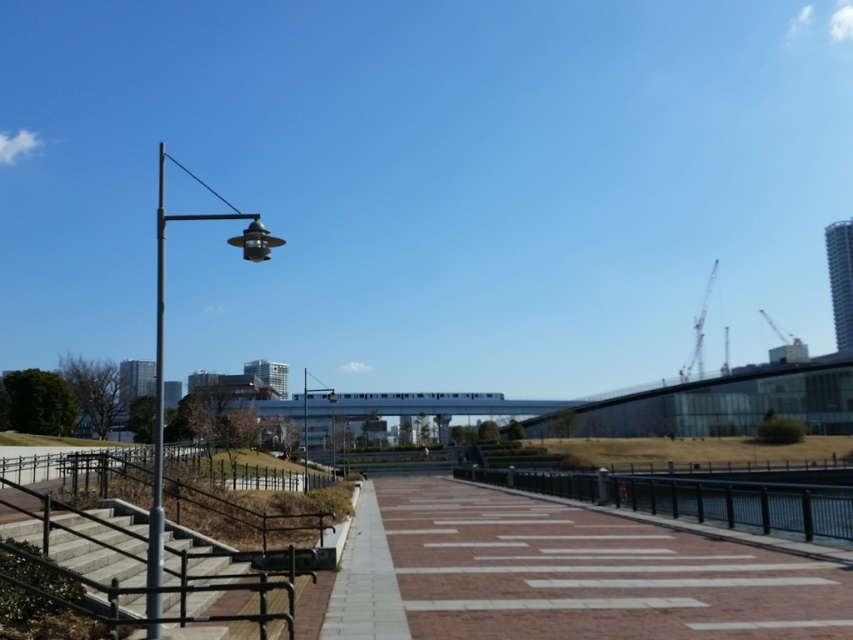
Question: Considering the real-world distances, which object is closest to the metallic gray pole at left?

Choices:
 (A) concrete stairs at lower left
 (B) black metal rail at center
 (C) metallic gray streetlight at left

Answer: (C)

Question: Based on their relative distances, which object is nearer to the metallic gray pole at left?

Choices:
 (A) black metal rail at center
 (B) metallic gray streetlight at left

Answer: (B)

Question: Can you confirm if black metal rail at center is thinner than metallic gray pole at left?

Choices:
 (A) no
 (B) yes

Answer: (B)

Question: Is the position of concrete stairs at lower left less distant than that of metallic gray streetlight at left?

Choices:
 (A) no
 (B) yes

Answer: (A)

Question: Which object appears farthest from the camera in this image?

Choices:
 (A) black metal rail at center
 (B) metallic gray pole at left

Answer: (A)

Question: Can you confirm if concrete stairs at lower left is wider than metallic gray pole at left?

Choices:
 (A) yes
 (B) no

Answer: (B)